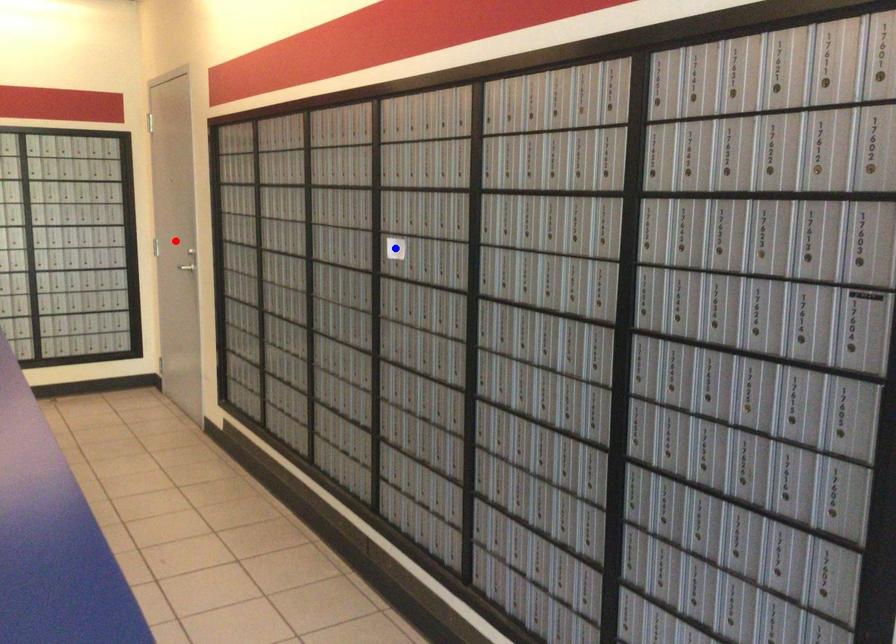
Question: Which of the two points in the image is closer to the camera?

Choices:
 (A) Blue point is closer.
 (B) Red point is closer.

Answer: (A)